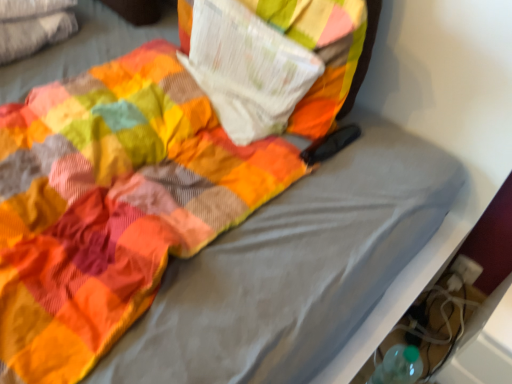
Identify the location of white paper at upper center. (247, 69).

This screenshot has height=384, width=512. What do you see at coordinates (247, 69) in the screenshot?
I see `white paper at upper center` at bounding box center [247, 69].

In order to face leather brown shoe at lower right, should I rotate leftwards or rightwards?

You should rotate right by 30.934 degrees.

Identify the location of leather brown shoe at lower right. This screenshot has height=384, width=512. (440, 321).

What do you see at coordinates (440, 321) in the screenshot? The height and width of the screenshot is (384, 512). I see `leather brown shoe at lower right` at bounding box center [440, 321].

This screenshot has height=384, width=512. Find the location of `white paper at upper center`. white paper at upper center is located at coordinates (247, 69).

Considering the positions of objects leather brown shoe at lower right and white paper at upper center in the image provided, who is more to the right, leather brown shoe at lower right or white paper at upper center?

Positioned to the right is leather brown shoe at lower right.

Looking at this image, considering the relative positions of leather brown shoe at lower right and white paper at upper center in the image provided, is leather brown shoe at lower right in front of white paper at upper center?

No, it is not.

Which is closer, (417, 338) or (220, 68)?

Point (417, 338) is farther from the camera than point (220, 68).

Based on the photo, from the image's perspective, which one is positioned lower, leather brown shoe at lower right or white paper at upper center?

leather brown shoe at lower right, from the image's perspective.

From a real-world perspective, is leather brown shoe at lower right positioned under white paper at upper center based on gravity?

Yes, from a real-world perspective, leather brown shoe at lower right is under white paper at upper center.

Looking at their sizes, would you say leather brown shoe at lower right is wider or thinner than white paper at upper center?

In the image, leather brown shoe at lower right appears to be wider than white paper at upper center.

In the scene shown: Considering the sizes of objects leather brown shoe at lower right and white paper at upper center in the image provided, who is taller, leather brown shoe at lower right or white paper at upper center?

With more height is leather brown shoe at lower right.

Based on their sizes in the image, would you say leather brown shoe at lower right is bigger or smaller than white paper at upper center?

In the image, leather brown shoe at lower right appears to be larger than white paper at upper center.

Do you think leather brown shoe at lower right is within white paper at upper center, or outside of it?

leather brown shoe at lower right is located beyond the bounds of white paper at upper center.

Are leather brown shoe at lower right and white paper at upper center far apart?

They are positioned close to each other.

Is leather brown shoe at lower right oriented towards white paper at upper center?

No, leather brown shoe at lower right is not oriented towards white paper at upper center.

Can you tell me how much leather brown shoe at lower right and white paper at upper center differ in facing direction?

leather brown shoe at lower right and white paper at upper center are facing 2.28 degrees away from each other.

Locate an element on the screen. paperback book on the left of leather brown shoe at lower right is located at coordinates (247, 69).

Is white paper at upper center to the right of leather brown shoe at lower right from the viewer's perspective?

In fact, white paper at upper center is to the left of leather brown shoe at lower right.

Is the position of white paper at upper center more distant than that of leather brown shoe at lower right?

No, it is not.

Which is more distant, [285,96] or [461,299]?

The point [461,299] is behind.

From the image's perspective, would you say white paper at upper center is positioned over leather brown shoe at lower right?

Indeed, from the image's perspective, white paper at upper center is shown above leather brown shoe at lower right.

From a real-world perspective, is white paper at upper center over leather brown shoe at lower right?

Yes, from a real-world perspective, white paper at upper center is on top of leather brown shoe at lower right.

Considering the sizes of white paper at upper center and leather brown shoe at lower right in the image, is white paper at upper center wider or thinner than leather brown shoe at lower right?

Considering their sizes, white paper at upper center looks slimmer than leather brown shoe at lower right.

Does white paper at upper center have a lesser height compared to leather brown shoe at lower right?

Yes.

Based on their sizes in the image, would you say white paper at upper center is bigger or smaller than leather brown shoe at lower right?

Considering their sizes, white paper at upper center takes up less space than leather brown shoe at lower right.

Is white paper at upper center not inside leather brown shoe at lower right?

That's correct, white paper at upper center is outside of leather brown shoe at lower right.

Are white paper at upper center and leather brown shoe at lower right beside each other?

Result: There is a gap between white paper at upper center and leather brown shoe at lower right.

Is white paper at upper center facing towards leather brown shoe at lower right?

No, white paper at upper center does not turn towards leather brown shoe at lower right.

How different are the orientations of white paper at upper center and leather brown shoe at lower right in degrees?

The angular difference between white paper at upper center and leather brown shoe at lower right is 2.28 degrees.

This screenshot has width=512, height=384. Find the location of `footwear beneath the white paper at upper center (from a real-world perspective)`. footwear beneath the white paper at upper center (from a real-world perspective) is located at coordinates pyautogui.click(x=440, y=321).

Where is `paperback book in front of the leather brown shoe at lower right`? This screenshot has height=384, width=512. paperback book in front of the leather brown shoe at lower right is located at coordinates (247, 69).

The image size is (512, 384). Identify the location of footwear below the white paper at upper center (from the image's perspective). (440, 321).